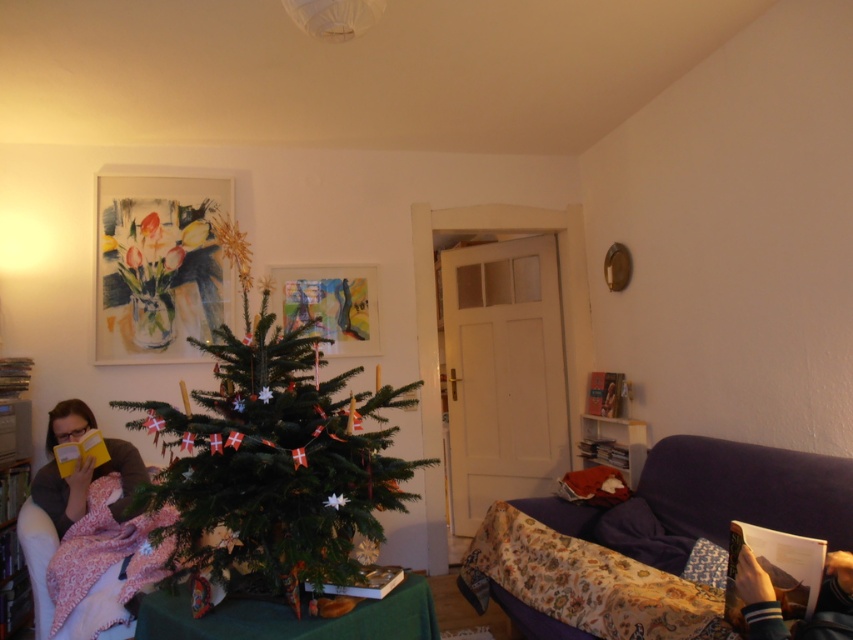
Does purple fabric couch at lower right appear on the left side of matte yellow book at left?

Incorrect, purple fabric couch at lower right is not on the left side of matte yellow book at left.

Between purple fabric couch at lower right and matte yellow book at left, which one appears on the left side from the viewer's perspective?

matte yellow book at left is more to the left.

Which is behind, point (585, 529) or point (122, 512)?

The point (585, 529) is behind.

Identify the location of purple fabric couch at lower right. (749, 483).

Who is lower down, green matte christmas tree at center or matte yellow book at left?

matte yellow book at left is lower down.

Between point (193, 547) and point (50, 513), which one is positioned in front?

Point (193, 547)

Describe the element at coordinates (274, 452) in the screenshot. I see `green matte christmas tree at center` at that location.

You are a GUI agent. You are given a task and a screenshot of the screen. Output one action in this format:
    pyautogui.click(x=<x>, y=<y>)
    Task: Click on the green matte christmas tree at center
    Image resolution: width=853 pixels, height=640 pixels.
    Given the screenshot: What is the action you would take?
    pyautogui.click(x=274, y=452)

Which is above, green matte christmas tree at center or purple fabric couch at lower right?

green matte christmas tree at center is above.

Which is behind, point (270, 556) or point (816, 468)?

Point (816, 468)

This screenshot has height=640, width=853. I want to click on green matte christmas tree at center, so click(274, 452).